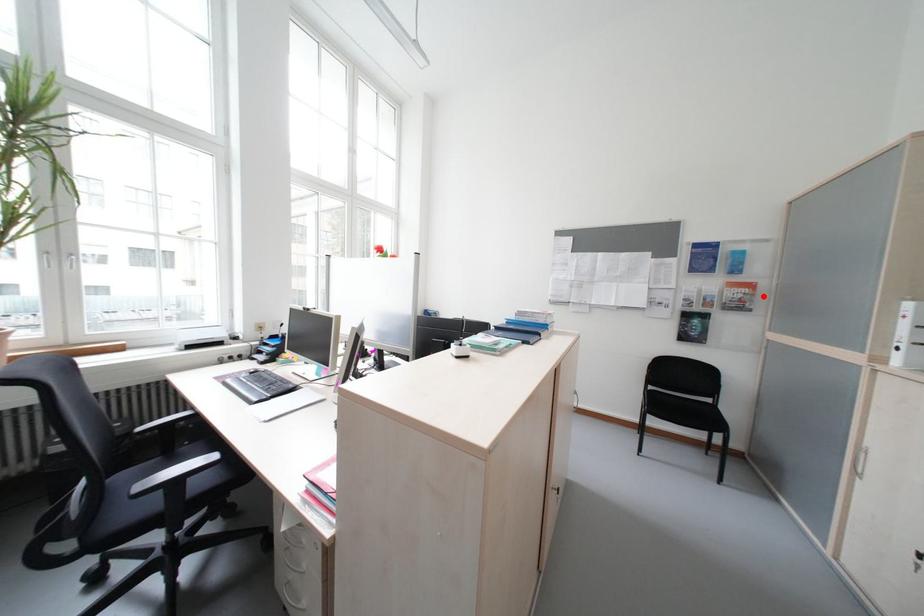
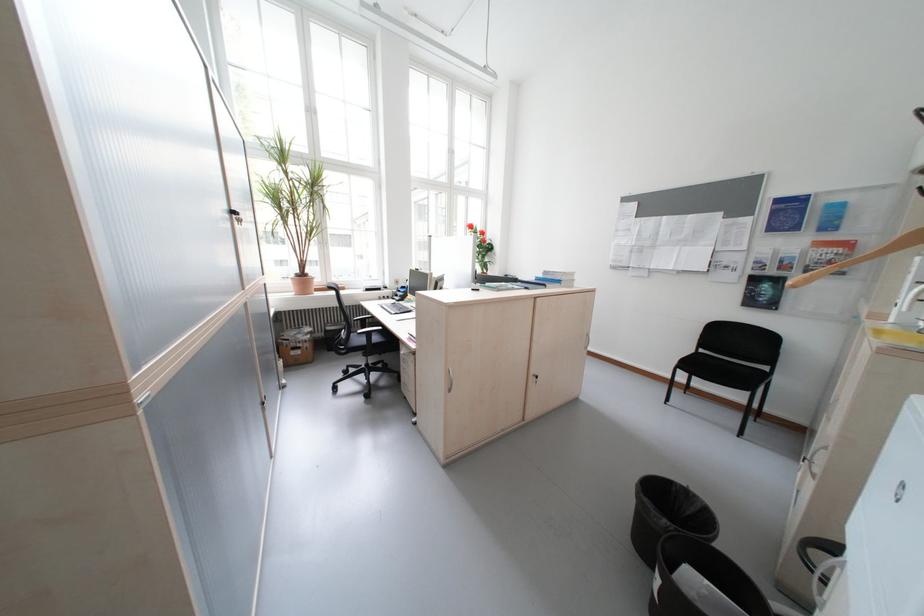
In the second image, find the point that corresponds to the highlighted location in the first image.

(859, 257)